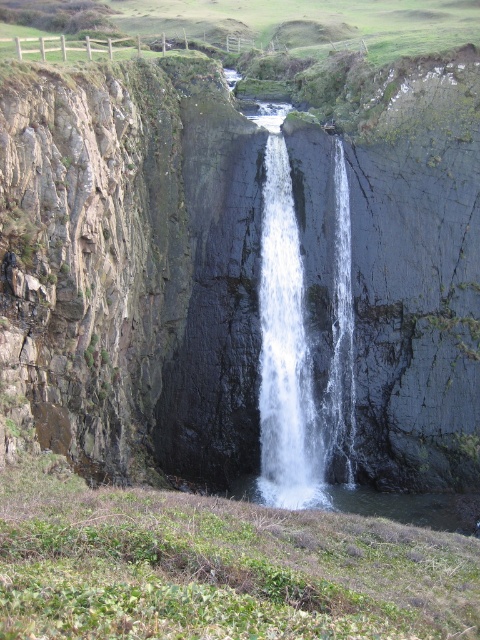
Question: Which point is closer to the camera?

Choices:
 (A) (300, 337)
 (B) (415, 420)

Answer: (A)

Question: Does dark gray rocky cliff at center appear on the left side of white frothy water at center?

Choices:
 (A) yes
 (B) no

Answer: (A)

Question: Can you confirm if dark gray rocky cliff at center is wider than white frothy water at center?

Choices:
 (A) yes
 (B) no

Answer: (A)

Question: Which point is closer to the camera?

Choices:
 (A) (262, 333)
 (B) (140, 326)

Answer: (B)

Question: Among these objects, which one is nearest to the camera?

Choices:
 (A) white frothy water at center
 (B) dark gray rocky cliff at center

Answer: (B)

Question: Does dark gray rocky cliff at center have a larger size compared to white frothy water at center?

Choices:
 (A) no
 (B) yes

Answer: (B)